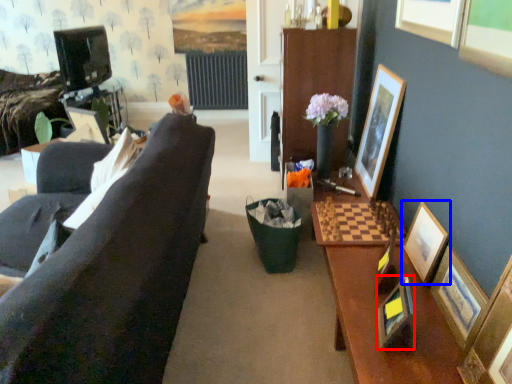
Question: Which object appears farthest to the camera in this image, picture frame (highlighted by a red box) or picture frame (highlighted by a blue box)?

Choices:
 (A) picture frame
 (B) picture frame

Answer: (B)